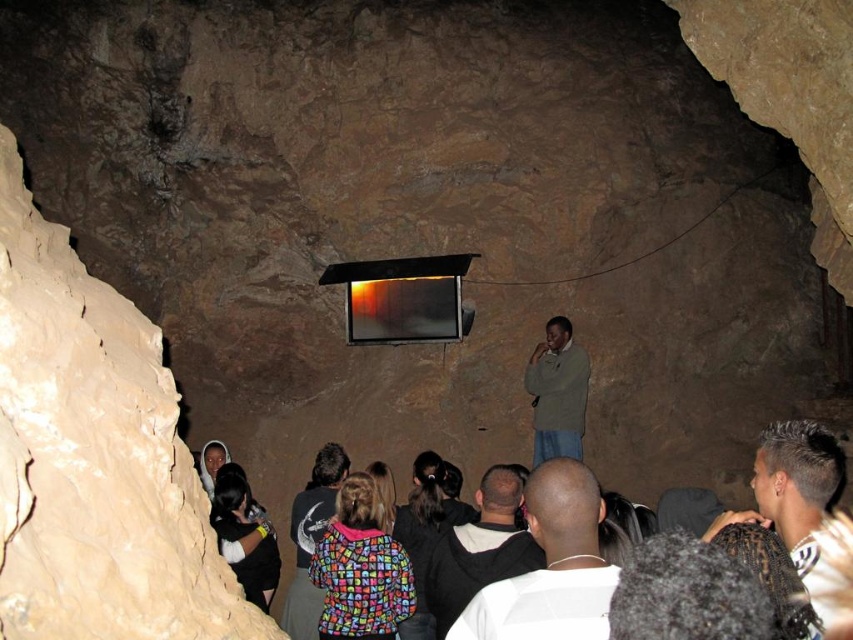
Question: From the image, what is the correct spatial relationship of green matte jacket at center in relation to multicolored fabric jacket at center?

Choices:
 (A) left
 (B) right

Answer: (B)

Question: Can you confirm if white shirt at center is positioned above dark brown hair at center?

Choices:
 (A) yes
 (B) no

Answer: (B)

Question: Does dark gray shirt at center have a smaller size compared to multicolored fabric jacket at center?

Choices:
 (A) no
 (B) yes

Answer: (B)

Question: Based on their relative distances, which object is nearer to the green matte jacket at center?

Choices:
 (A) white shirt at center
 (B) dark brown hair at center
 (C) multicolored fabric jacket at center

Answer: (C)

Question: Which object is positioned farthest from the green matte jacket at center?

Choices:
 (A) dark gray shirt at center
 (B) multicolored fabric crowd at center
 (C) white shirt at center
 (D) multicolored fabric jacket at center

Answer: (C)

Question: Based on their relative distances, which object is farther from the dark brown hair at center?

Choices:
 (A) green matte jacket at center
 (B) dark gray shirt at center
 (C) white shirt at center

Answer: (A)